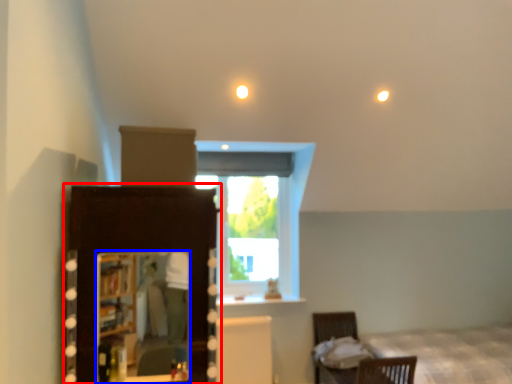
Question: Which object is closer to the camera taking this photo, dresser (highlighted by a red box) or mirror (highlighted by a blue box)?

Choices:
 (A) dresser
 (B) mirror

Answer: (A)